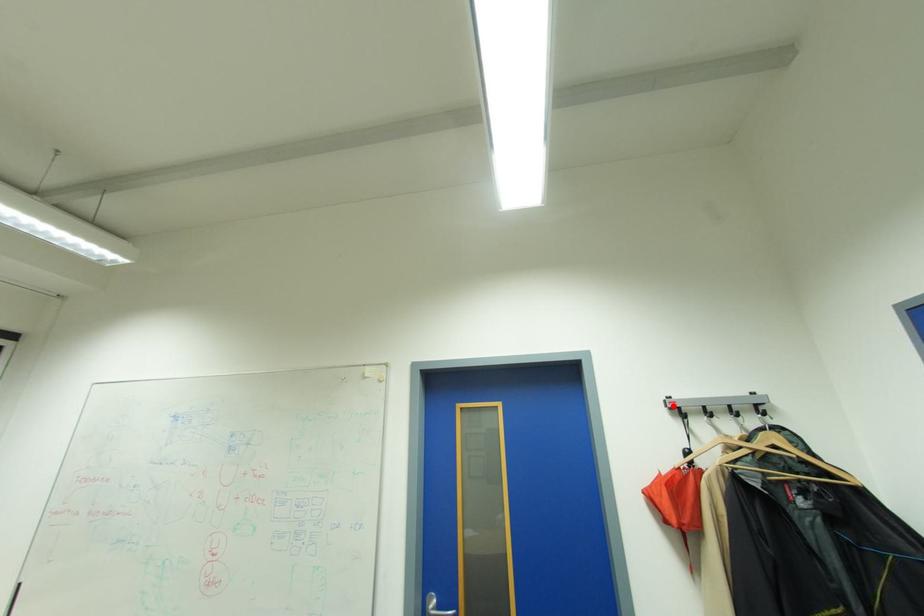
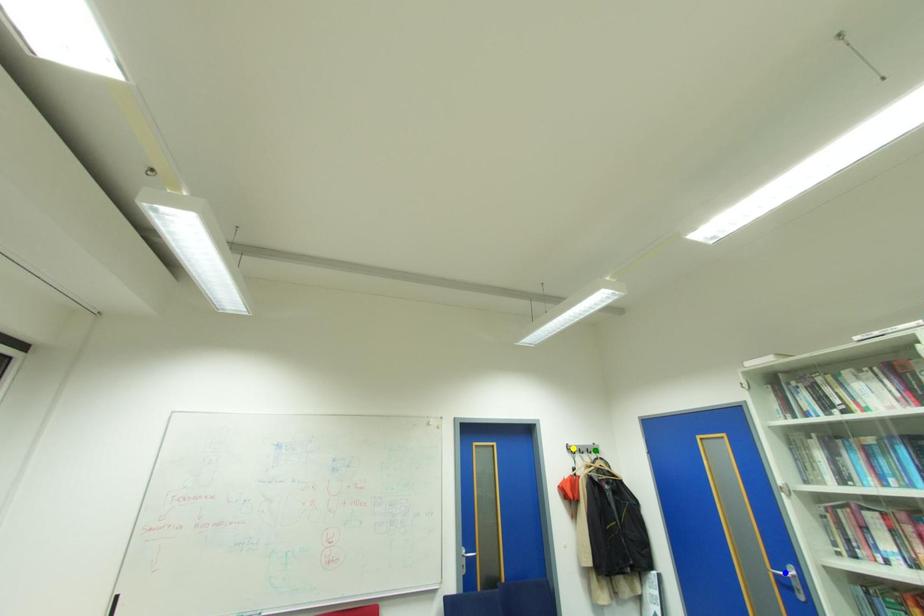
Question: I am providing you with two images of the same scene from different viewpoints. A red point is marked on the first image. You are given multiple points on the second image. Which spot in image 2 lines up with the point in image 1?

Choices:
 (A) blue point
 (B) yellow point
 (C) green point

Answer: (B)